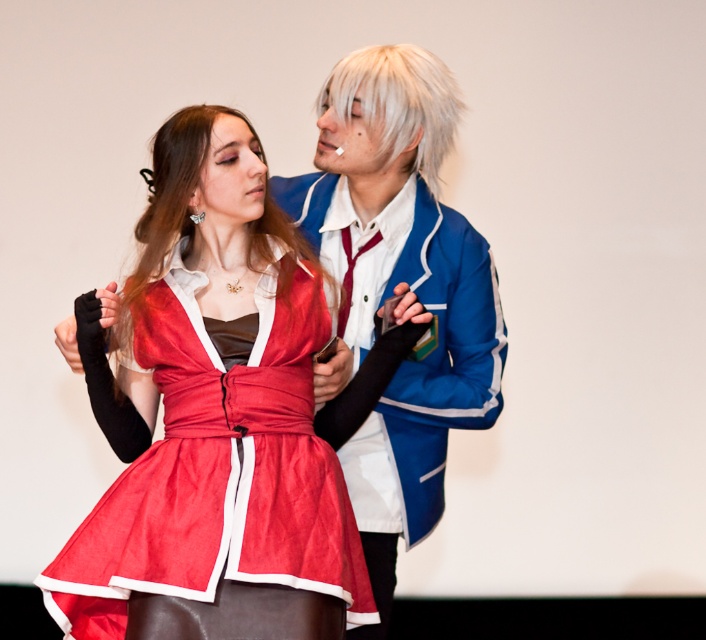
You are a photographer trying to capture a clear shot of both the blonde silky hair at center and the white silky hair at upper center. Based on their positions, which hair style will appear larger in the photo?

The blonde silky hair at center will appear larger in the photo because it is much taller than the white silky hair at upper center.

You are a photographer setting up for a photoshoot. You need to ensure that the satin dress at center and the white silky hair at upper center are both visible in the frame. Based on their positions, which object should you focus on first to capture both elements effectively?

The white silky hair at upper center should be focused on first since it is positioned higher than the satin dress at center, allowing the camera to capture both elements in the frame.